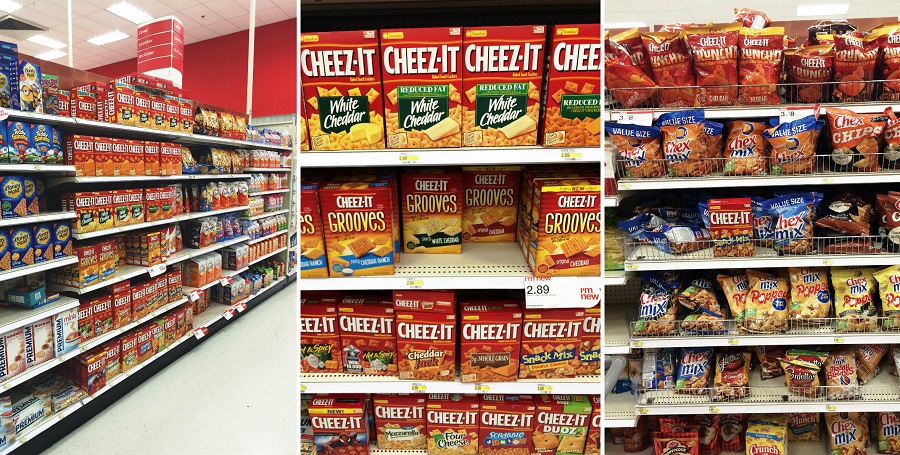
At what (x,y) coordinates should I click in order to perform the action: click on metal grate front of shelves. Please return your answer as a coordinate pair (x, y). Looking at the image, I should click on (814, 388), (842, 322), (850, 238), (860, 166), (862, 91).